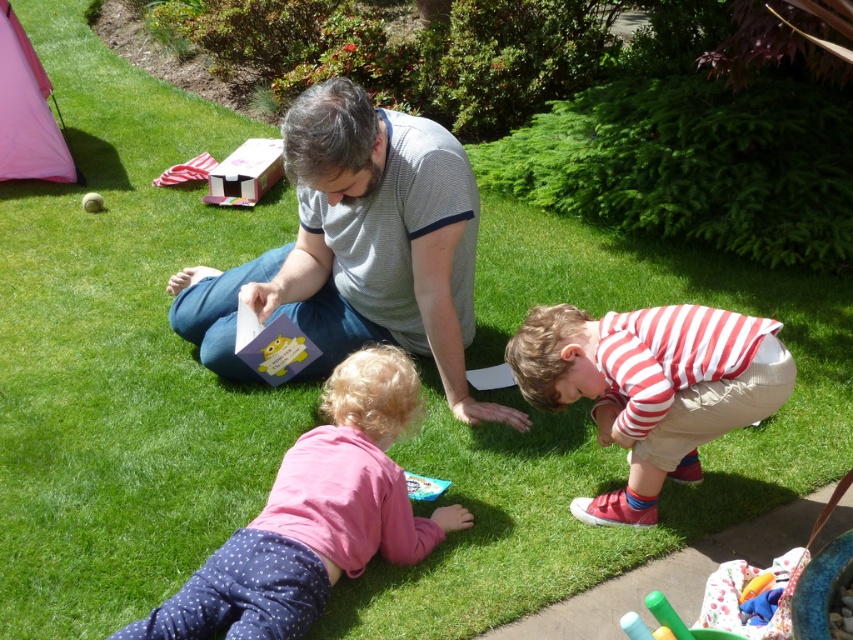
You are a photographer trying to capture a photo of the cardboard box at upper center without including the striped cotton shirt at lower right in the frame. Based on their positions, is this possible?

The striped cotton shirt at lower right is to the right of the cardboard box at upper center, so by positioning the camera to the left side of the cardboard box at upper center, the photographer can exclude the striped cotton shirt at lower right from the frame.

In the scene shown: You are a photographer positioned at the edge of the lawn. You want to take a photo that includes both the striped cotton shirt at lower right and the cardboard box at upper center. Which object should you adjust your camera angle to focus on first to ensure both are in frame?

You should first focus on the striped cotton shirt at lower right because it is closer to the viewer than the cardboard box at upper center, ensuring both are in frame by adjusting the angle to include both.

You are standing at the point marked by the coordinates point [358,248] in the image. What is the nearest object to you?

The point [358,248] is on gray striped shirt at center, so the nearest object to you is the gray striped shirt at center.